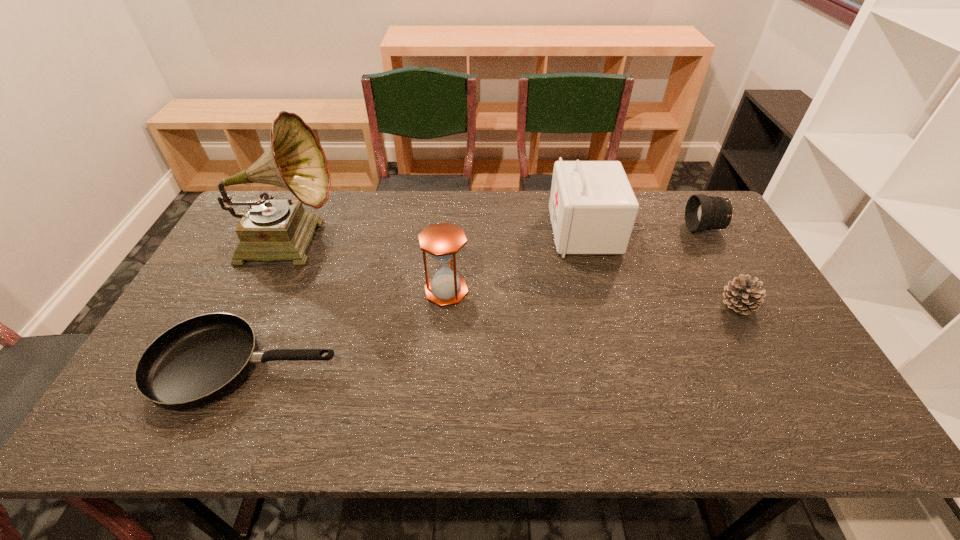
What are the coordinates of `vacant area that lies between the fourth object from left to right and the fourth shortest object` in the screenshot? It's located at (516, 261).

This screenshot has width=960, height=540. I want to click on vacant area that lies between the third object from right to left and the telephoto lens, so click(644, 230).

You are a GUI agent. You are given a task and a screenshot of the screen. Output one action in this format:
    pyautogui.click(x=<x>, y=<y>)
    Task: Click on the vacant space that's between the pinecone and the nearest object
    
    Given the screenshot: What is the action you would take?
    pyautogui.click(x=492, y=335)

Find the location of a particular element. The height and width of the screenshot is (540, 960). unoccupied area between the second shortest object and the record player is located at coordinates (513, 272).

Find the location of a particular element. The width and height of the screenshot is (960, 540). vacant space in between the second tallest object and the second shortest object is located at coordinates (660, 268).

Locate an element on the screen. object that is the fifth closest to the record player is located at coordinates (702, 212).

Where is `object that stands as the fourth closest to the nearest object`? Image resolution: width=960 pixels, height=540 pixels. object that stands as the fourth closest to the nearest object is located at coordinates (743, 295).

Where is `blank space that satisfies the following two spatial constraints: 1. on the front side of the hourglass; 2. at the end of the handle of the shortest object`? The image size is (960, 540). blank space that satisfies the following two spatial constraints: 1. on the front side of the hourglass; 2. at the end of the handle of the shortest object is located at coordinates [441, 366].